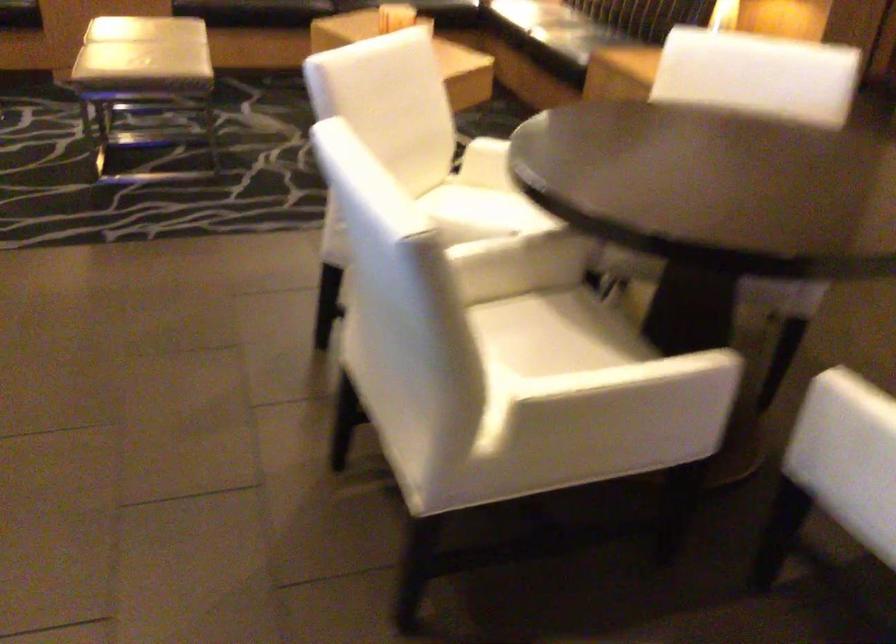
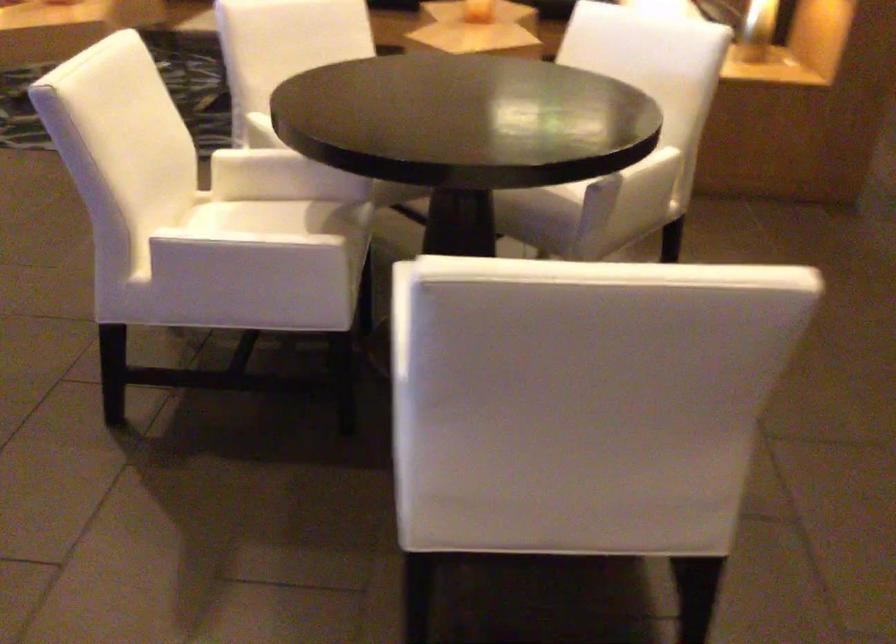
In the second image, find the point that corresponds to point 627,343 in the first image.

(347, 240)